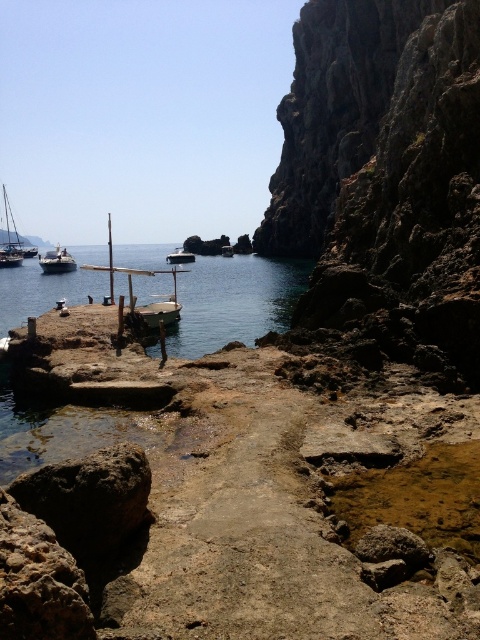
Who is shorter, rusty rock at lower left or white glossy boat at center?

Standing shorter between the two is rusty rock at lower left.

Is point (93, 461) more distant than point (188, 259)?

No, (93, 461) is in front of (188, 259).

The width and height of the screenshot is (480, 640). In order to click on rusty rock at lower left in this screenshot , I will do `click(90, 499)`.

Does metallic silver boat at left have a lesser width compared to white glossy boat at center?

Incorrect, metallic silver boat at left's width is not less than white glossy boat at center's.

Is metallic silver boat at left positioned before white glossy boat at center?

Yes.

Measure the distance between metallic silver boat at left and camera.

They are 352.03 feet apart.

Locate an element on the screen. This screenshot has height=640, width=480. metallic silver boat at left is located at coordinates pyautogui.click(x=57, y=260).

Locate an element on the screen. The image size is (480, 640). white glossy boat at center is located at coordinates pyautogui.click(x=180, y=257).

What do you see at coordinates (180, 257) in the screenshot? I see `white glossy boat at center` at bounding box center [180, 257].

Locate an element on the screen. The width and height of the screenshot is (480, 640). white glossy boat at center is located at coordinates (180, 257).